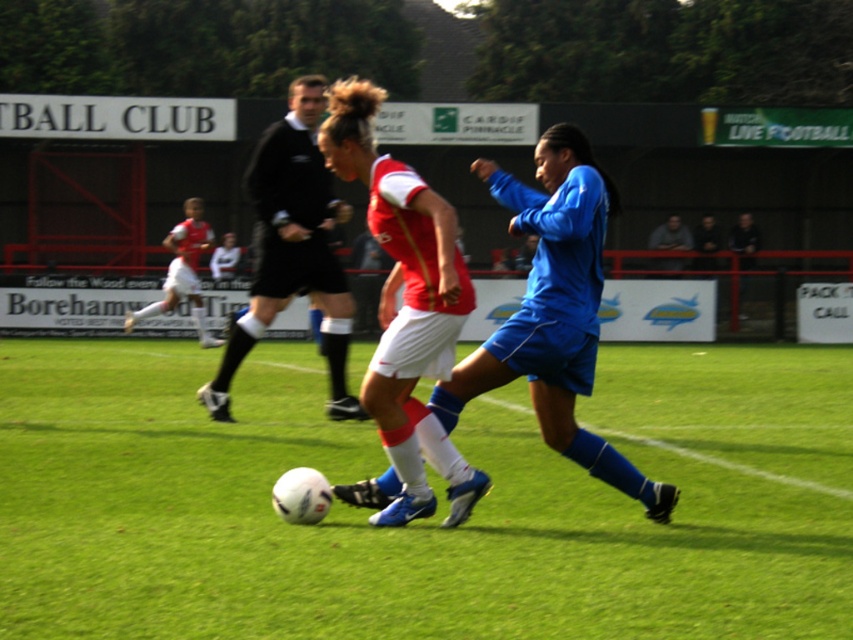
Is green grass football field at center below blue fabric jersey at center?

Correct, green grass football field at center is located below blue fabric jersey at center.

Measure the distance between point (100, 593) and camera.

They are 18.07 feet apart.

The height and width of the screenshot is (640, 853). I want to click on green grass football field at center, so click(x=419, y=522).

Measure the distance between black jersey at center and camera.

black jersey at center is 10.47 meters away from camera.

Is point (325, 301) in front of point (664, 244)?

Yes, it is.

Is point (329, 337) farther from camera compared to point (670, 248)?

No, it is not.

Where is `black jersey at center`? The height and width of the screenshot is (640, 853). black jersey at center is located at coordinates (292, 248).

Is green grass football field at center above black jersey at center?

No, green grass football field at center is not above black jersey at center.

Between green grass football field at center and black jersey at center, which one is positioned lower?

Positioned lower is green grass football field at center.

Is point (561, 460) in front of point (334, 326)?

Yes, point (561, 460) is closer to viewer.

Where is `green grass football field at center`? This screenshot has width=853, height=640. green grass football field at center is located at coordinates (419, 522).